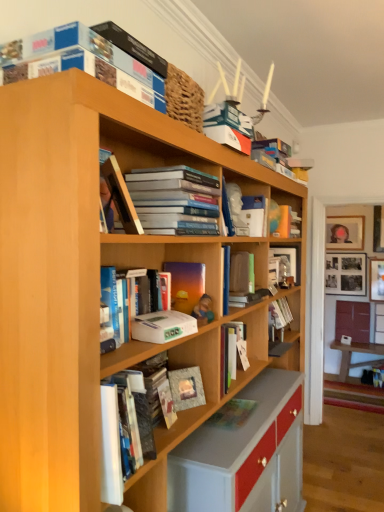
Locate an element on the screen. The image size is (384, 512). wooden table at lower right is located at coordinates (357, 352).

What is the approximate width of wooden bookshelf at right?

It is 8.05 inches.

Where is `wooden bookshelf at right`? Image resolution: width=384 pixels, height=512 pixels. wooden bookshelf at right is located at coordinates (334, 330).

Describe the element at coordinates (283, 265) in the screenshot. This screenshot has width=384, height=512. I see `matte black frame at upper center, positioned as the 1th book in back-to-front order` at that location.

Locate an element on the screen. satin gold frame at center, which appears as the fourth book when viewed from the front is located at coordinates (186, 284).

What is the approximate width of matte orange vase at center, the 3th book when ordered from back to front?

matte orange vase at center, the 3th book when ordered from back to front, is 7.85 inches in width.

You are a GUI agent. You are given a task and a screenshot of the screen. Output one action in this format:
    pyautogui.click(x=<x>, y=<y>)
    Task: Click on the wooden picture frame at upper right
    The image size is (384, 512).
    Given the screenshot: What is the action you would take?
    pyautogui.click(x=345, y=232)

At what (x,y) coordinates should I click in order to perform the action: click on matte blue book at upper center, the 6th book positioned from the front. Please return your answer as a coordinate pair (x, y). Looking at the image, I should click on (280, 159).

Where is `wooden table at lower right`? The height and width of the screenshot is (512, 384). wooden table at lower right is located at coordinates (357, 352).

From the image's perspective, which is below, matte orange vase at center, which is counted as the 7th book, starting from the front, or wooden table at lower right?

wooden table at lower right.

Is matte orange vase at center, the 3th book when ordered from back to front, far from wooden table at lower right?

That's right, there is a large distance between matte orange vase at center, the 3th book when ordered from back to front, and wooden table at lower right.

Does matte orange vase at center, the 3th book when ordered from back to front, have a lesser width compared to wooden table at lower right?

Yes.

Looking at this image, do you think matte orange vase at center, the 3th book when ordered from back to front, is within wooden table at lower right, or outside of it?

matte orange vase at center, the 3th book when ordered from back to front, lies outside wooden table at lower right.

Based on the photo, which object is thinner, matte blue book at upper center, the 6th book positioned from the front, or white matte paperback book at center, which is the second paperback book in bottom-to-top order?

With smaller width is white matte paperback book at center, which is the second paperback book in bottom-to-top order.

Is matte blue book at upper center, marked as the 4th book in a back-to-front arrangement, at the left side of white matte paperback book at center, which is the second paperback book in bottom-to-top order?

Incorrect, matte blue book at upper center, marked as the 4th book in a back-to-front arrangement, is not on the left side of white matte paperback book at center, which is the second paperback book in bottom-to-top order.

Would you say matte blue book at upper center, the 6th book positioned from the front, is a long distance from white matte paperback book at center, the 1th paperback book when ordered from top to bottom?

matte blue book at upper center, the 6th book positioned from the front, is positioned a significant distance from white matte paperback book at center, the 1th paperback book when ordered from top to bottom.

Is point (299, 168) closer or farther from the camera than point (170, 324)?

Point (299, 168).

From the image's perspective, which one is positioned lower, wooden bookshelf at right or wooden table at lower right?

From the image's view, wooden table at lower right is below.

How different are the orientations of wooden bookshelf at right and wooden table at lower right in degrees?

The angle between the facing direction of wooden bookshelf at right and the facing direction of wooden table at lower right is 0.000891 degrees.

Who is smaller, wooden bookshelf at right or wooden table at lower right?

wooden table at lower right.

From their relative heights in the image, would you say wooden bookshelf at right is taller or shorter than wooden table at lower right?

Considering their sizes, wooden bookshelf at right has more height than wooden table at lower right.

Does point (140, 316) come closer to viewer compared to point (191, 404)?

That is True.

Does white matte paperback book at center, which is the second paperback book in bottom-to-top order, have a lesser width compared to matte gray paperback book at center, which is the 1th paperback book from back to front?

No.

Who is taller, white matte paperback book at center, the 1th paperback book when ordered from top to bottom, or matte gray paperback book at center, which is the 2th paperback book from front to back?

matte gray paperback book at center, which is the 2th paperback book from front to back.

Is the depth of white matte paperback book at center, which is the 2th paperback book from back to front, less than that of matte gray paperback book at center, which is the 2th paperback book from front to back?

Yes, white matte paperback book at center, which is the 2th paperback book from back to front, is closer to the camera.

From a real-world perspective, is hardcover book at center, the 8th book in the front-to-back sequence, on top of wooden table at lower right?

Yes, from a real-world perspective, hardcover book at center, the 8th book in the front-to-back sequence, is on top of wooden table at lower right.

Is hardcover book at center, the second book viewed from the back, in front of or behind wooden table at lower right in the image?

Visually, hardcover book at center, the second book viewed from the back, is located in front of wooden table at lower right.

From the image's perspective, is hardcover book at center, the second book viewed from the back, beneath wooden table at lower right?

No.

Which object is wider, hardcover book at center, the 8th book in the front-to-back sequence, or wooden table at lower right?

wooden table at lower right is wider.

Is matte black frame at upper center, the 9th book in the front-to-back sequence, in front of or behind wooden picture frame at upper right in the image?

Clearly, matte black frame at upper center, the 9th book in the front-to-back sequence, is in front of wooden picture frame at upper right.

Is matte black frame at upper center, the 9th book in the front-to-back sequence, turned away from wooden picture frame at upper right?

Yes, matte black frame at upper center, the 9th book in the front-to-back sequence, is positioned with its back facing wooden picture frame at upper right.

Is matte black frame at upper center, the 9th book in the front-to-back sequence, shorter than wooden picture frame at upper right?

Indeed, matte black frame at upper center, the 9th book in the front-to-back sequence, has a lesser height compared to wooden picture frame at upper right.

From a real-world perspective, which object stands above the other?

wooden picture frame at upper right is physically above.

Is blue cardboard box at upper center, which appears as the ninth book when viewed from the back, to the right of wooden bookshelf at right from the viewer's perspective?

No.

What are the coordinates of `bookstore that appears below the blue cardboard box at upper center, which appears as the ninth book when viewed from the back (from the image's perspective)` in the screenshot? It's located at (334, 330).

Would you consider blue cardboard box at upper center, which is counted as the 1th book, starting from the front, to be distant from wooden bookshelf at right?

blue cardboard box at upper center, which is counted as the 1th book, starting from the front, is far away from wooden bookshelf at right.

Between blue cardboard box at upper center, which appears as the ninth book when viewed from the back, and wooden bookshelf at right, which one has larger size?

wooden bookshelf at right is bigger.

You are a GUI agent. You are given a task and a screenshot of the screen. Output one action in this format:
    pyautogui.click(x=<x>, y=<y>)
    Task: Click on the table that is under the matte orange vase at center, the 3th book when ordered from back to front (from a real-world perspective)
    
    Given the screenshot: What is the action you would take?
    pyautogui.click(x=357, y=352)

From the image's perspective, starting from the white matte paperback book at center, which is the second paperback book in bottom-to-top order, which book is the 7th one above? Please provide its 2D coordinates.

[(280, 159)]

Estimate the real-world distances between objects in this image. Which object is closer to matte orange vase at center, the 3th book when ordered from back to front, matte blue book at upper center, marked as the 4th book in a back-to-front arrangement, or white matte paperback book at center, which is the second paperback book in bottom-to-top order?

Based on the image, matte blue book at upper center, marked as the 4th book in a back-to-front arrangement, appears to be nearer to matte orange vase at center, the 3th book when ordered from back to front.

Which object lies nearer to the anchor point matte blue book at upper center, the 6th book positioned from the front, wooden picture frame at upper right or matte orange vase at center, the 3th book when ordered from back to front?

matte orange vase at center, the 3th book when ordered from back to front, is closer to matte blue book at upper center, the 6th book positioned from the front.

Considering their positions, is matte orange vase at center, the 3th book when ordered from back to front, positioned closer to blue cardboard box at upper center, which is counted as the 1th book, starting from the front, than hardcover book at center, the 8th book in the front-to-back sequence?

matte orange vase at center, the 3th book when ordered from back to front, is positioned closer to the anchor blue cardboard box at upper center, which is counted as the 1th book, starting from the front.

Looking at the image, which one is located further to hardcover book at upper center, which is counted as the second book, starting from the front, hardcover books at upper center, the 7th book viewed from the back, or matte gray paperback book at center, which is the 2th paperback book from front to back?

matte gray paperback book at center, which is the 2th paperback book from front to back.

Considering their positions, is wooden bookshelf at right positioned closer to wooden table at lower right than wooden picture frame at upper right?

wooden bookshelf at right.

When comparing their distances from wooden picture frame at upper right, does satin gold frame at center, which appears as the fourth book when viewed from the front, or hardcover book at upper center, the 8th book in the back-to-front sequence, seem closer?

The object closer to wooden picture frame at upper right is satin gold frame at center, which appears as the fourth book when viewed from the front.

Estimate the real-world distances between objects in this image. Which object is further from hardcover books at upper center, the third book viewed from the front, white matte paperback book at center, the 1th paperback book when ordered from top to bottom, or matte orange vase at center, which is counted as the 7th book, starting from the front?

matte orange vase at center, which is counted as the 7th book, starting from the front, is further to hardcover books at upper center, the third book viewed from the front.

Looking at the image, which one is located closer to matte black frame at upper center, the 9th book in the front-to-back sequence, white matte paperback book at center, the 1th paperback book when ordered from top to bottom, or matte green book at center, the fifth book positioned from the front?

Based on the image, matte green book at center, the fifth book positioned from the front, appears to be nearer to matte black frame at upper center, the 9th book in the front-to-back sequence.

Where is `bookstore positioned between matte green book at center, the fifth book positioned from the front, and wooden picture frame at upper right from near to far`? The image size is (384, 512). bookstore positioned between matte green book at center, the fifth book positioned from the front, and wooden picture frame at upper right from near to far is located at coordinates (334, 330).

The height and width of the screenshot is (512, 384). I want to click on bookstore between hardcover books at upper center, the third book viewed from the front, and wooden picture frame at upper right in the front-back direction, so click(x=334, y=330).

At what (x,y) coordinates should I click in order to perform the action: click on bookstore between matte black frame at upper center, the 9th book in the front-to-back sequence, and wooden picture frame at upper right from front to back. Please return your answer as a coordinate pair (x, y). The image size is (384, 512). Looking at the image, I should click on (334, 330).

At what (x,y) coordinates should I click in order to perform the action: click on paperback book between hardcover books at upper center, the 7th book viewed from the back, and wooden bookshelf at right, along the z-axis. Please return your answer as a coordinate pair (x, y). This screenshot has width=384, height=512. Looking at the image, I should click on (186, 388).